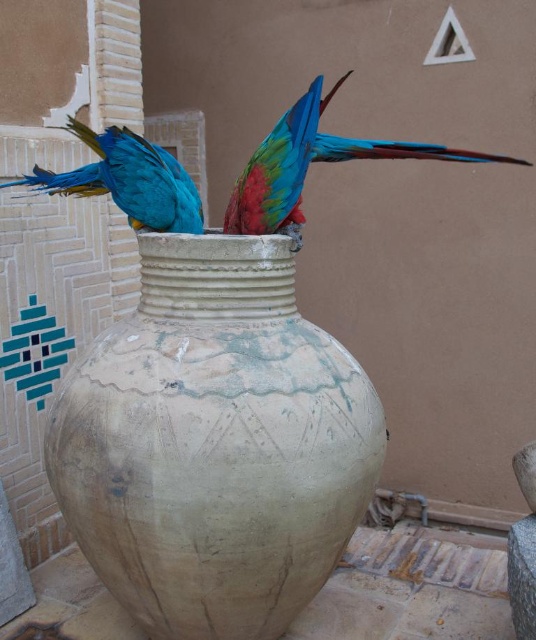
Which is behind, point (79, 401) or point (378, 150)?

The point (378, 150) is behind.

Is earthy clay vase at center to the right of shiny blue parrot at upper center from the viewer's perspective?

In fact, earthy clay vase at center is to the left of shiny blue parrot at upper center.

Is point (312, 509) closer to viewer compared to point (428, 156)?

Yes, point (312, 509) is closer to viewer.

The image size is (536, 640). I want to click on earthy clay vase at center, so click(214, 444).

Can you confirm if shiny blue parrot at upper center is positioned below blue glossy parrot at upper center?

No.

Is point (490, 161) positioned behind point (157, 172)?

That is True.

You are a GUI agent. You are given a task and a screenshot of the screen. Output one action in this format:
    pyautogui.click(x=<x>, y=<y>)
    Task: Click on the shiny blue parrot at upper center
    The image size is (536, 640).
    Given the screenshot: What is the action you would take?
    pyautogui.click(x=312, y=161)

In the scene shown: Who is shorter, earthy clay vase at center or blue glossy parrot at upper center?

blue glossy parrot at upper center

Which is above, earthy clay vase at center or blue glossy parrot at upper center?

blue glossy parrot at upper center is higher up.

Image resolution: width=536 pixels, height=640 pixels. Describe the element at coordinates (214, 444) in the screenshot. I see `earthy clay vase at center` at that location.

I want to click on earthy clay vase at center, so click(214, 444).